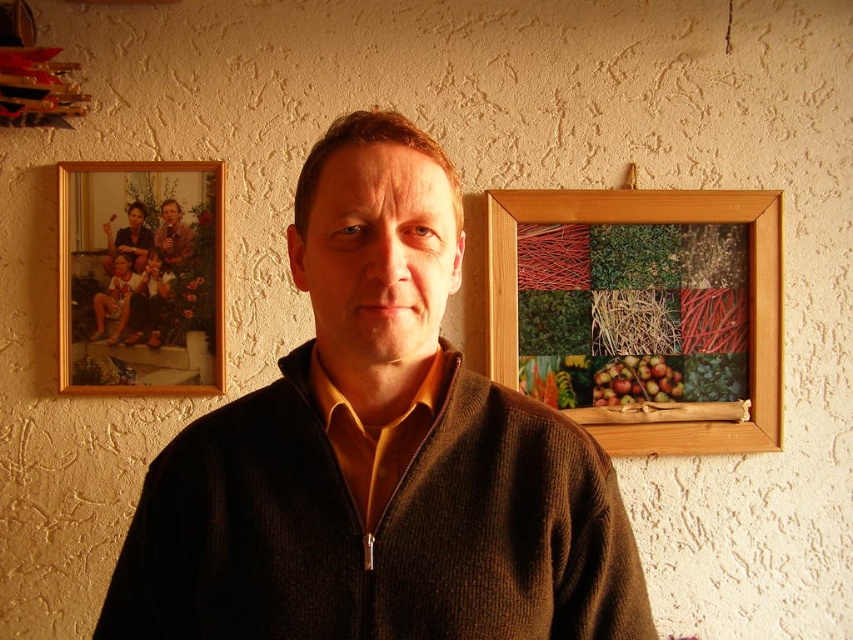
Question: In this image, where is wooden picture frame at upper right located relative to shiny red apples at upper right?

Choices:
 (A) right
 (B) left

Answer: (A)

Question: Which object is the farthest from the brown knitted sweater at center?

Choices:
 (A) shiny red apples at upper right
 (B) gold wooden picture frame at upper left
 (C) wooden picture frame at upper right

Answer: (A)

Question: Is wooden picture frame at upper right to the right of gold wooden picture frame at upper left from the viewer's perspective?

Choices:
 (A) yes
 (B) no

Answer: (A)

Question: Which object is farther from the camera taking this photo?

Choices:
 (A) shiny red apples at upper right
 (B) gold wooden picture frame at upper left

Answer: (A)

Question: Among these points, which one is farthest from the camera?

Choices:
 (A) (625, 291)
 (B) (625, 380)
 (C) (325, 273)

Answer: (B)

Question: Is wooden picture frame at upper right to the left of shiny red apples at upper right from the viewer's perspective?

Choices:
 (A) yes
 (B) no

Answer: (B)